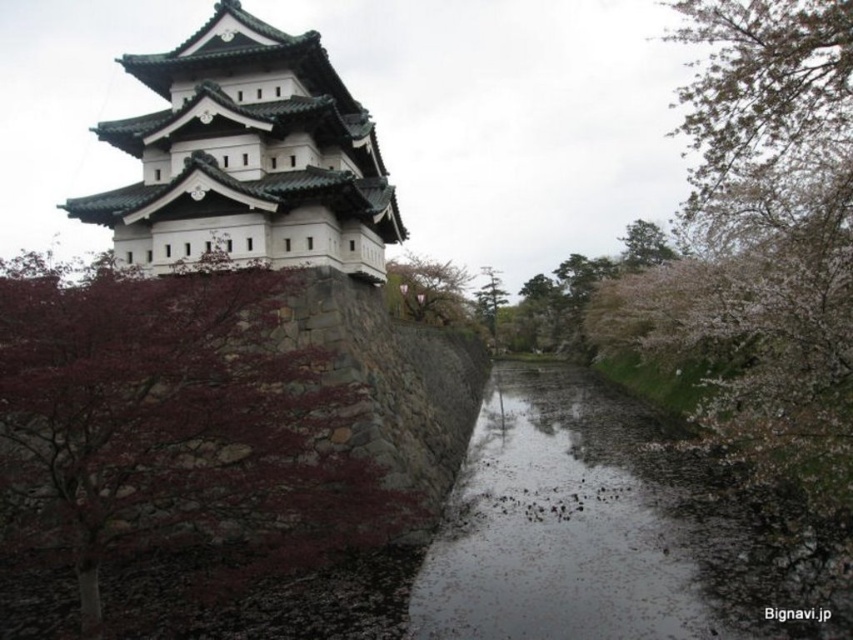
Question: Among these objects, which one is nearest to the camera?

Choices:
 (A) white stone tower at upper left
 (B) green textured tree at center
 (C) dark red bark tree at left

Answer: (C)

Question: Among these objects, which one is nearest to the camera?

Choices:
 (A) slightly glossy white tree at center
 (B) dark red bark tree at left
 (C) white stone tower at upper left

Answer: (B)

Question: Which object is the farthest from the slightly glossy white tree at center?

Choices:
 (A) white stone tower at upper left
 (B) green leafy tree at upper center

Answer: (A)

Question: From the image, what is the correct spatial relationship of white stone tower at upper left in relation to green leafy tree at upper center?

Choices:
 (A) right
 (B) left

Answer: (B)

Question: Can you confirm if white stone tower at upper left is positioned above slightly glossy white tree at center?

Choices:
 (A) no
 (B) yes

Answer: (B)

Question: Does white blossoming branches at upper right have a lesser width compared to green leafy tree at upper center?

Choices:
 (A) yes
 (B) no

Answer: (B)